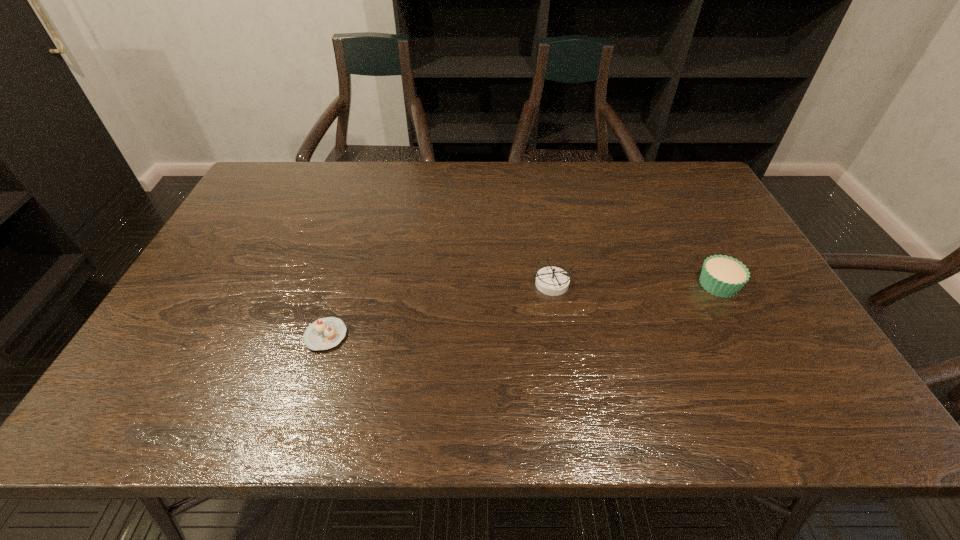
Image resolution: width=960 pixels, height=540 pixels. I want to click on vacant space at the near edge, so click(x=637, y=406).

Where is `vacant space at the right edge of the desktop`? This screenshot has width=960, height=540. vacant space at the right edge of the desktop is located at coordinates (764, 351).

Locate an element on the screen. This screenshot has width=960, height=540. free location at the far right corner is located at coordinates (706, 200).

You are a GUI agent. You are given a task and a screenshot of the screen. Output one action in this format:
    pyautogui.click(x=<x>, y=<y>)
    Task: Click on the vacant point located between the nearer cupcake and the right cupcake
    
    Given the screenshot: What is the action you would take?
    pyautogui.click(x=522, y=310)

Where is `empty space that is in between the nearer cupcake and the taller cupcake`? empty space that is in between the nearer cupcake and the taller cupcake is located at coordinates (522, 310).

You are a GUI agent. You are given a task and a screenshot of the screen. Output one action in this format:
    pyautogui.click(x=<x>, y=<y>)
    Task: Click on the free point between the rightmost object and the second object from right to left
    The height and width of the screenshot is (540, 960).
    Given the screenshot: What is the action you would take?
    coord(635,284)

Identify the location of vacant region between the rightmost object and the left cupcake. (522, 310).

Locate an element on the screen. vacant point located between the rightmost object and the left cupcake is located at coordinates (522, 310).

The width and height of the screenshot is (960, 540). Identify the location of vacant area that lies between the nearer cupcake and the second object from right to left. (439, 309).

Locate an element on the screen. The width and height of the screenshot is (960, 540). free area in between the leftmost object and the farther cupcake is located at coordinates (522, 310).